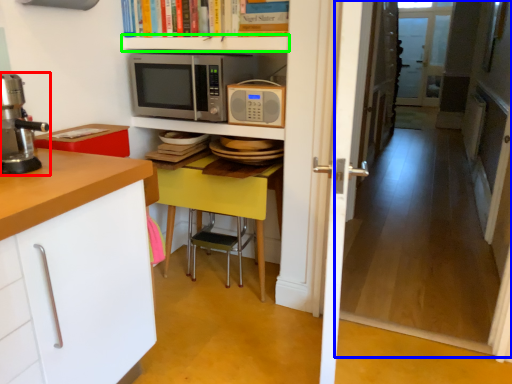
Question: Based on their relative distances, which object is farther from home appliance (highlighted by a red box)? Choose from corridor (highlighted by a blue box) and shelf (highlighted by a green box).

Choices:
 (A) corridor
 (B) shelf

Answer: (A)